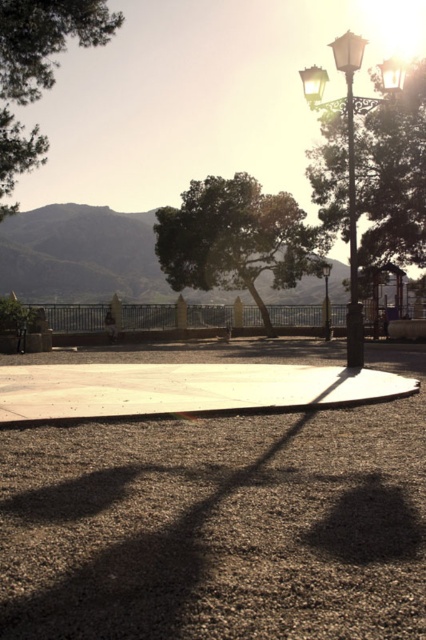
In the scene shown: You are standing at the lamppost and want to walk to the point marked as point (x=0, y=10). Is the point marked as point (x=164, y=227) between you and your destination?

Point (x=164, y=227) is behind point (x=0, y=10), so it is not between you and your destination.

You are standing at the circular paved area and want to take a photo of the green leafy tree at center. However, there is another green leafy tree at upper left in the scene. Which tree will appear closer to you in the photo?

The green leafy tree at center will appear closer to you in the photo because the green leafy tree at upper left is behind it, making the tree at center the foreground element.

You are standing at the base of the metallic streetlight at center and want to walk towards the metallic streetlight at upper right. Which direction should you face to move towards it?

You should face the upper direction to move towards the metallic streetlight at upper right since it is located above the metallic streetlight at center.